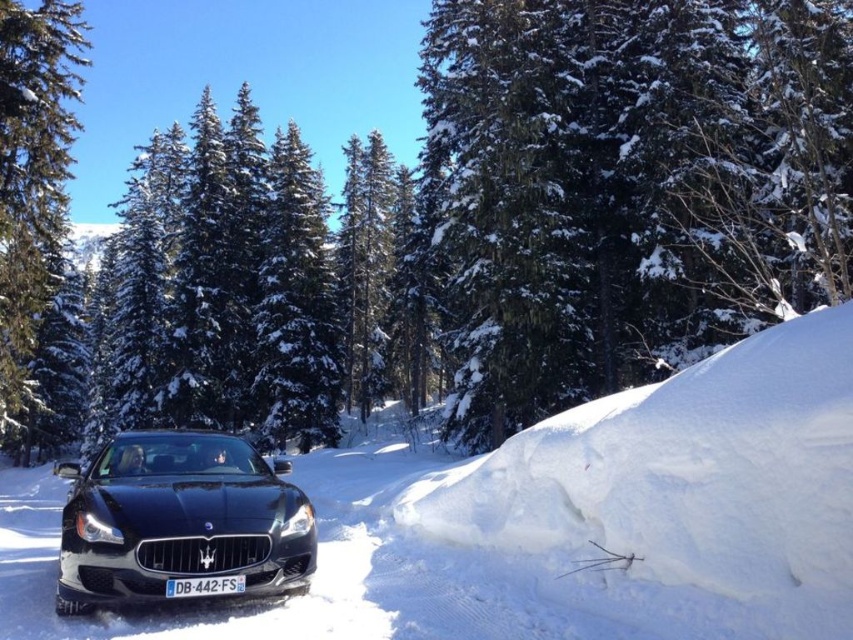
Can you confirm if white fluffy snow at center is bigger than glossy black car at center?

Yes.

Is white fluffy snow at center shorter than glossy black car at center?

In fact, white fluffy snow at center may be taller than glossy black car at center.

The image size is (853, 640). What are the coordinates of `white fluffy snow at center` in the screenshot? It's located at (552, 520).

Can you confirm if glossy black car at center is smaller than white plastic license plate at center?

Yes, glossy black car at center is smaller than white plastic license plate at center.

Between glossy black car at center and white plastic license plate at center, which one is positioned higher?

glossy black car at center is above.

Between point (300, 492) and point (195, 593), which one is positioned behind?

The point (300, 492) is behind.

Locate an element on the screen. This screenshot has height=640, width=853. glossy black car at center is located at coordinates (178, 518).

Is green textured pine tree at upper left to the left of white plastic license plate at center from the viewer's perspective?

Indeed, green textured pine tree at upper left is positioned on the left side of white plastic license plate at center.

Is green textured pine tree at upper left above white plastic license plate at center?

Yes.

Does point (44, 168) lie in front of point (180, 589)?

No, it is behind (180, 589).

Where is `green textured pine tree at upper left`? The image size is (853, 640). green textured pine tree at upper left is located at coordinates (32, 177).